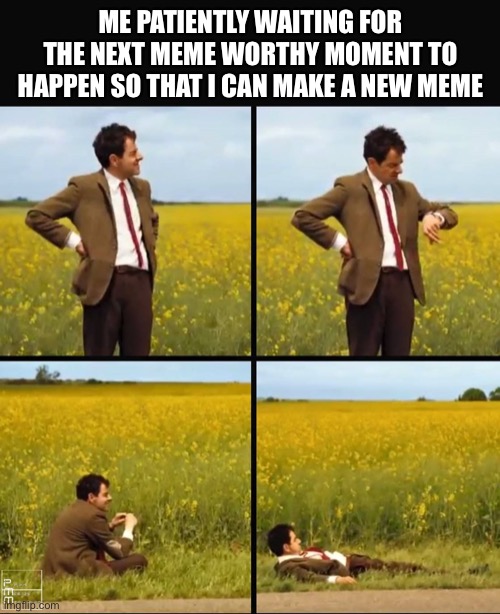
Where is `panes`? panes is located at coordinates (224, 201), (283, 188), (156, 460), (320, 448).